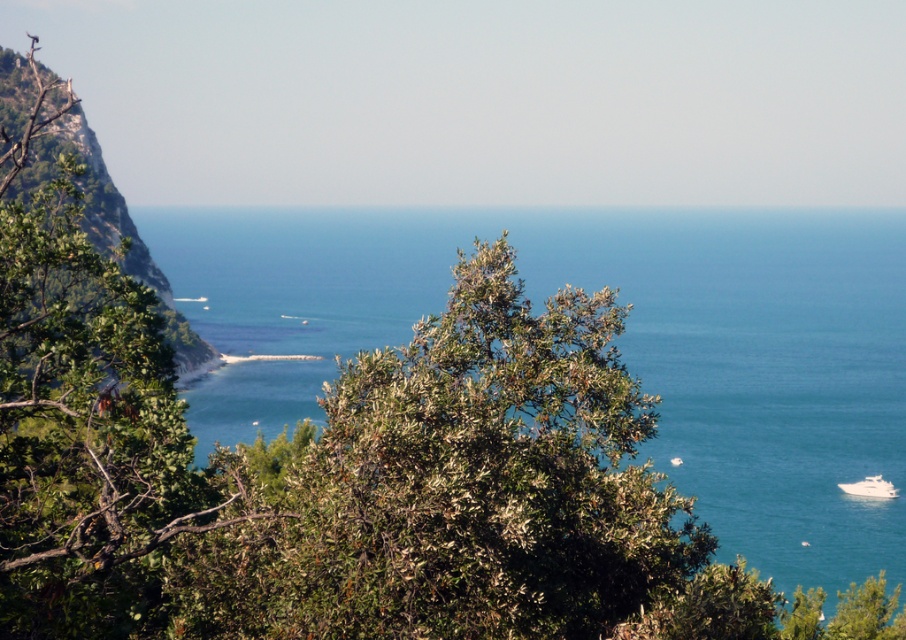
Question: Is the position of blue water at center less distant than that of green leafy hillside at left?

Choices:
 (A) no
 (B) yes

Answer: (B)

Question: Which object is farther from the camera taking this photo?

Choices:
 (A) blue water at center
 (B) green leafy hillside at left

Answer: (B)

Question: Among these objects, which one is nearest to the camera?

Choices:
 (A) green leafy hillside at left
 (B) blue water at center

Answer: (B)

Question: From the image, what is the correct spatial relationship of blue water at center in relation to green leafy hillside at left?

Choices:
 (A) left
 (B) right

Answer: (B)

Question: Is the position of blue water at center less distant than that of green leafy hillside at left?

Choices:
 (A) yes
 (B) no

Answer: (A)

Question: Among these objects, which one is nearest to the camera?

Choices:
 (A) blue water at center
 (B) green leafy hillside at left

Answer: (A)